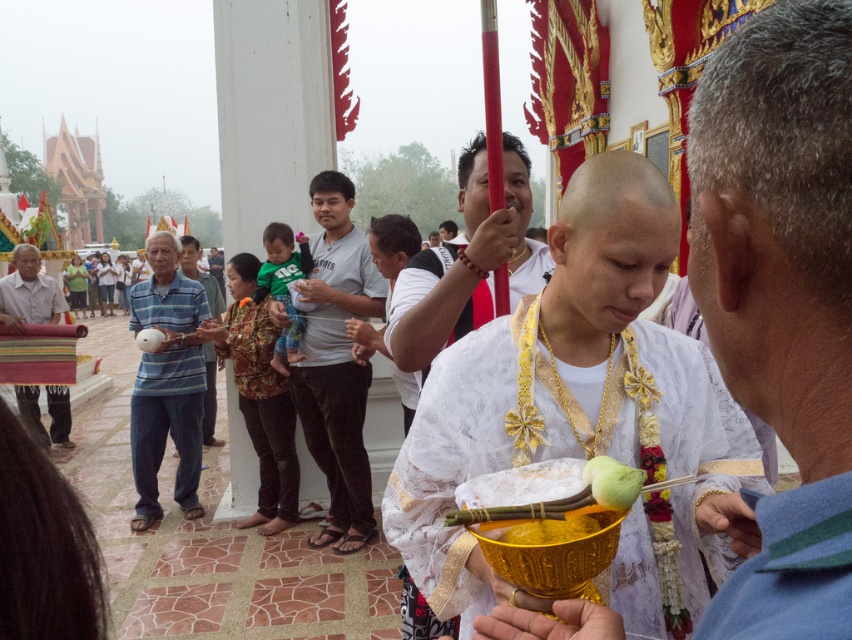
You are a visitor at this temple event and want to take a photo of the white clothed monk at center and the yellow matte coconut at center. Which object should you focus on first if you want to capture both in the same frame without zooming?

The white clothed monk at center has a smaller size compared to yellow matte coconut at center, so you should focus on the yellow matte coconut at center first to ensure both fit in the frame.

You are standing in the temple and want to move from the golden bowl to the line of people. The golden bowl is located at point (735,413) and the line of people is at point (209,353). Which direction should you move to reach the line of people?

Point (735,413) is closer to the viewer than point (209,353), so you should move away from your current position towards the line of people at point (209,353) to reach them.

You are a photographer at the event and want to capture the person in the white lace robe at center and the white matte bowl at center in a single shot. Based on their positions, which object should you focus on first to ensure both are in frame?

The white lace robe at center is located below the white matte bowl at center, so you should focus on the white matte bowl at center first to ensure both are in frame.